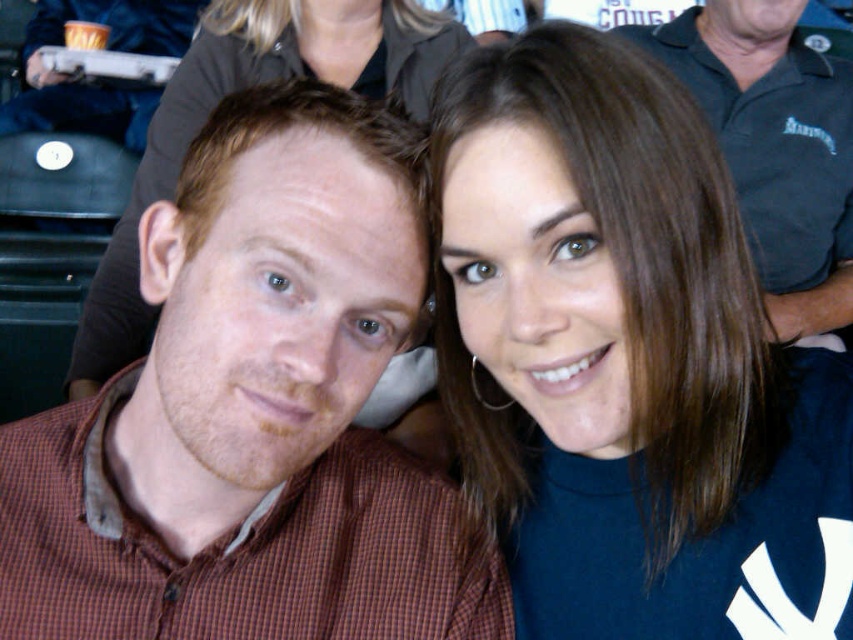
Question: Can you confirm if brown hair at upper right is thinner than brown checkered shirt at left?

Choices:
 (A) no
 (B) yes

Answer: (B)

Question: Considering the relative positions of brown checkered shirt at left and dark blue polo shirt at upper center in the image provided, where is brown checkered shirt at left located with respect to dark blue polo shirt at upper center?

Choices:
 (A) above
 (B) below

Answer: (B)

Question: Which point is closer to the camera taking this photo?

Choices:
 (A) (822, 296)
 (B) (668, 369)
 (C) (62, 572)

Answer: (B)

Question: Which of the following is the farthest from the observer?

Choices:
 (A) (648, 636)
 (B) (141, 211)
 (C) (735, 84)
 (D) (277, 628)

Answer: (C)

Question: Can you confirm if brown hair at upper right is thinner than dark blue polo shirt at upper center?

Choices:
 (A) yes
 (B) no

Answer: (A)

Question: Which of these objects is positioned farthest from the dark blue polo shirt at upper center?

Choices:
 (A) brown hair at upper right
 (B) matte blue turtleneck at upper right

Answer: (A)